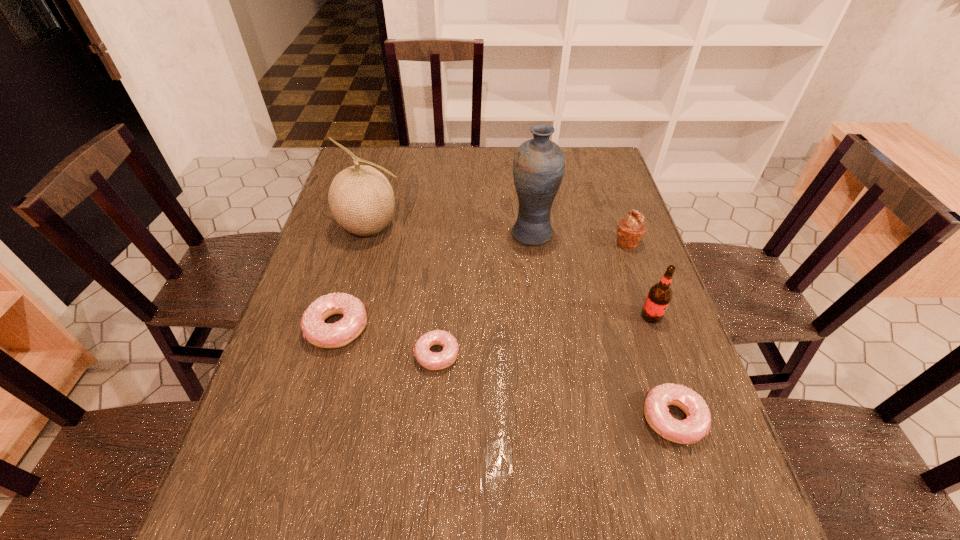
I want to click on vacant space at the near left corner of the desktop, so click(313, 446).

Identify the location of free area in between the tallest doughnut and the root beer. (494, 321).

Identify the location of vacant area that lies between the second doughnut from left to right and the sixth shortest object. The width and height of the screenshot is (960, 540). (404, 291).

At what (x,y) coordinates should I click in order to perform the action: click on vacant space that is in between the sixth shortest object and the fourth shortest object. Please return your answer as a coordinate pair (x, y). The image size is (960, 540). Looking at the image, I should click on (499, 235).

At what (x,y) coordinates should I click in order to perform the action: click on free area in between the fourth shortest object and the second tallest object. Please return your answer as a coordinate pair (x, y). The width and height of the screenshot is (960, 540). Looking at the image, I should click on (499, 235).

You are a GUI agent. You are given a task and a screenshot of the screen. Output one action in this format:
    pyautogui.click(x=<x>, y=<y>)
    Task: Click on the vacant space that's between the nearest doughnut and the shortest object
    
    Given the screenshot: What is the action you would take?
    pyautogui.click(x=555, y=387)

The image size is (960, 540). What are the coordinates of `free space that is in between the nearest object and the fourth object from left to right` in the screenshot? It's located at (602, 326).

Find the location of a particular element. The image size is (960, 540). free space that is in between the fifth object from right to left and the tallest doughnut is located at coordinates coord(387,341).

Identify the location of vacant space that is in between the second tallest object and the leftmost doughnut. (354, 278).

The height and width of the screenshot is (540, 960). I want to click on vacant area that lies between the cantaloup and the shortest doughnut, so click(404, 291).